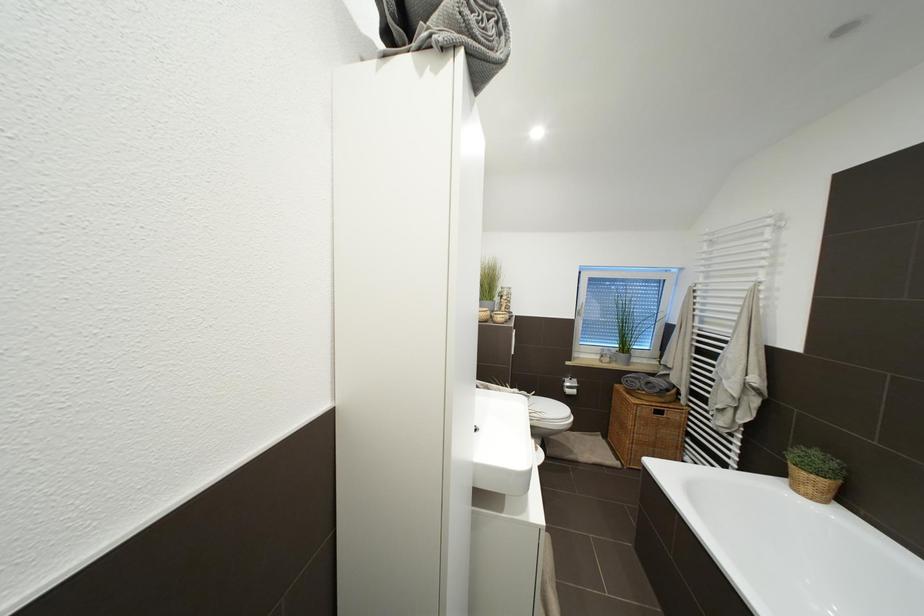
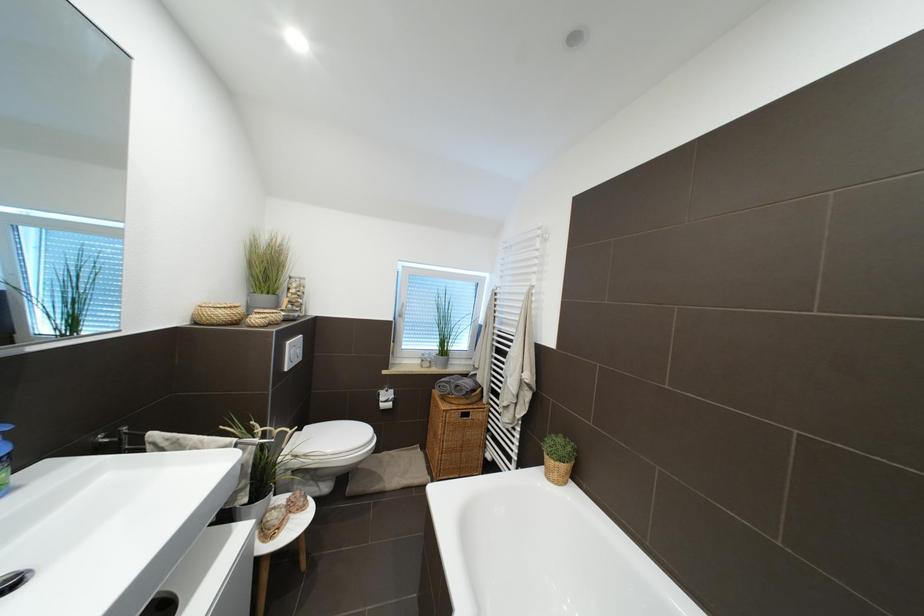
Question: The camera is either moving clockwise (left) or counter-clockwise (right) around the object. The first image is from the beginning of the video and the second image is from the end. Is the camera moving left or right when shooting the video?

Choices:
 (A) Left
 (B) Right

Answer: (A)